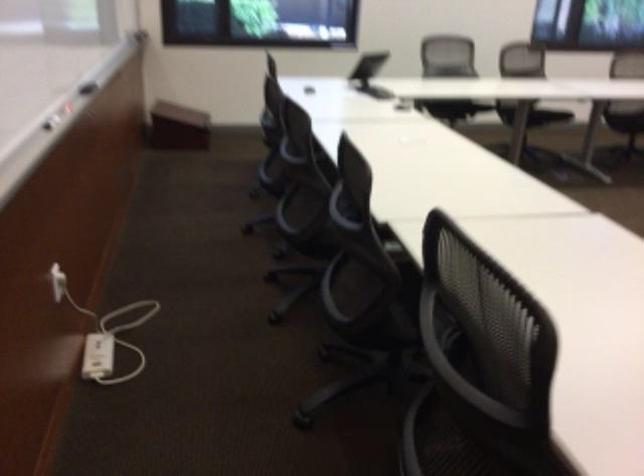
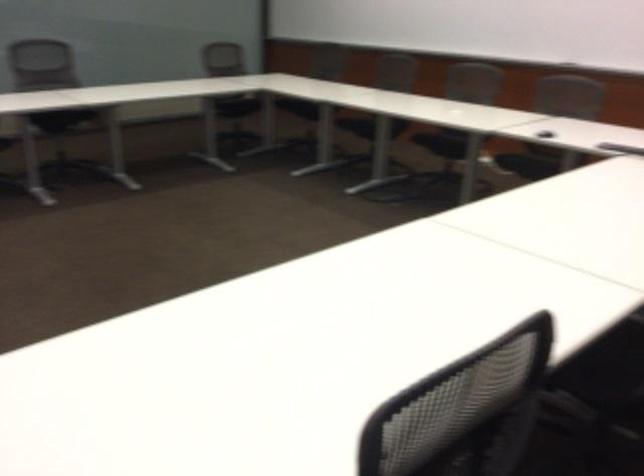
The first image is from the beginning of the video and the second image is from the end. How did the camera likely rotate when shooting the video?

The camera rotated toward right-down.